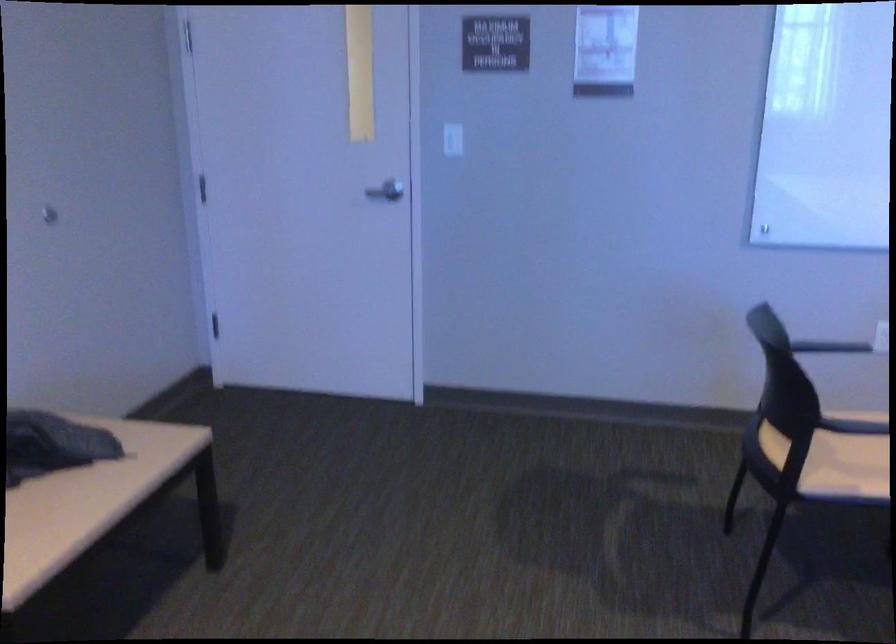
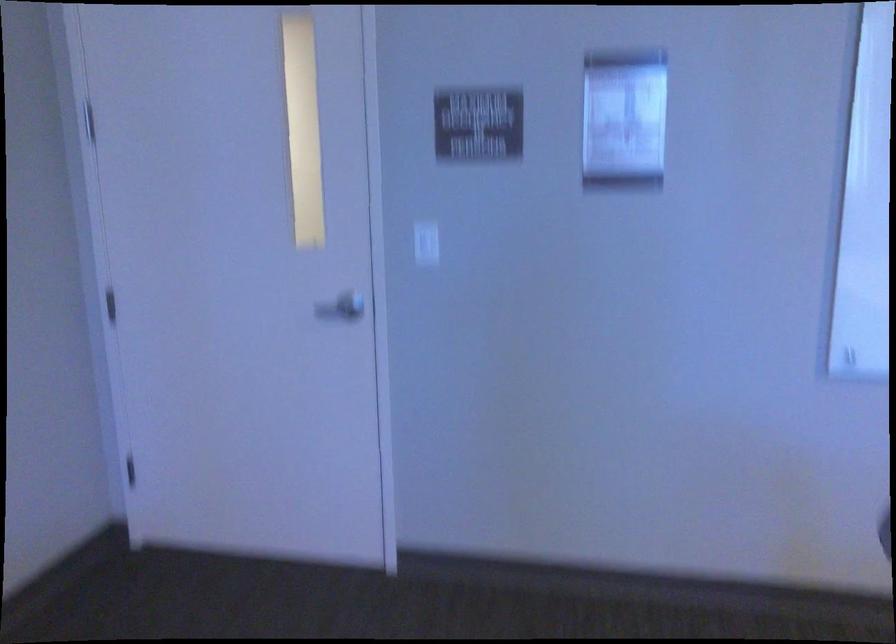
Find the pixel in the second image that matches the point at 452,140 in the first image.

(426, 243)